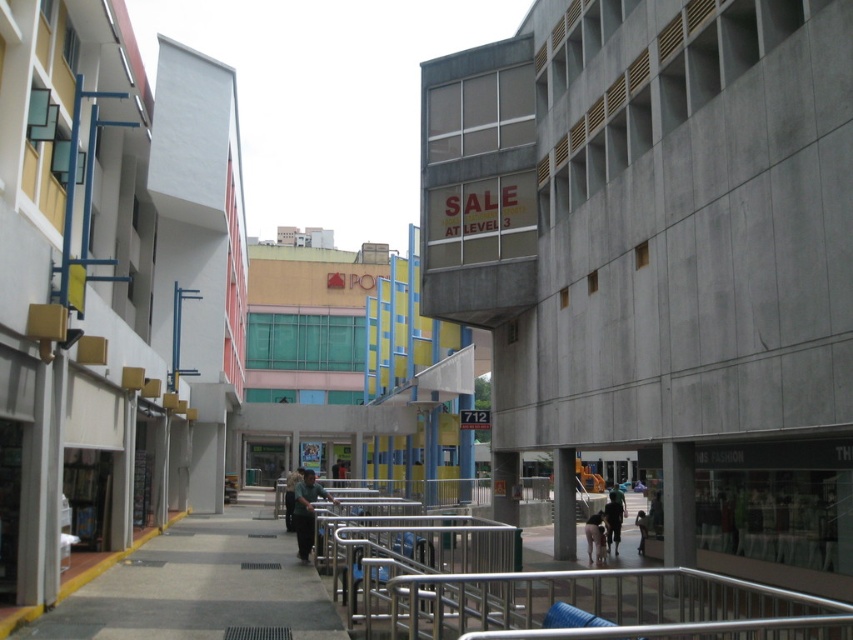
You are standing in the urban shopping area and see both the gray concrete pavement at center and the dark blue fabric jacket at center. Which object is positioned more to the left?

The gray concrete pavement at center is positioned to the left of the dark blue fabric jacket at center.

You are a customer standing at the entrance of the shopping area and see the dark gray fabric jacket at center and the light brown leather jacket at lower right. Which jacket is closer to you?

The dark gray fabric jacket at center is closer to you because it is in front of the light brown leather jacket at lower right.